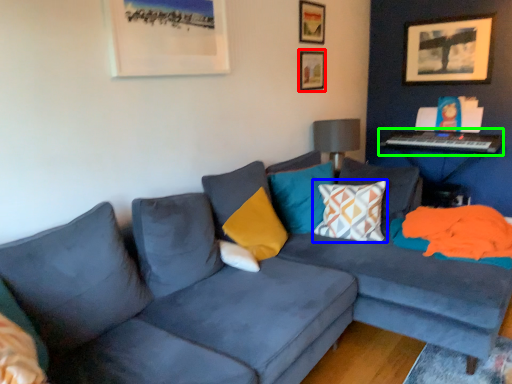
Question: Considering the real-world distances, which object is closest to picture frame (highlighted by a red box)? pillow (highlighted by a blue box) or piano (highlighted by a green box).

Choices:
 (A) pillow
 (B) piano

Answer: (B)